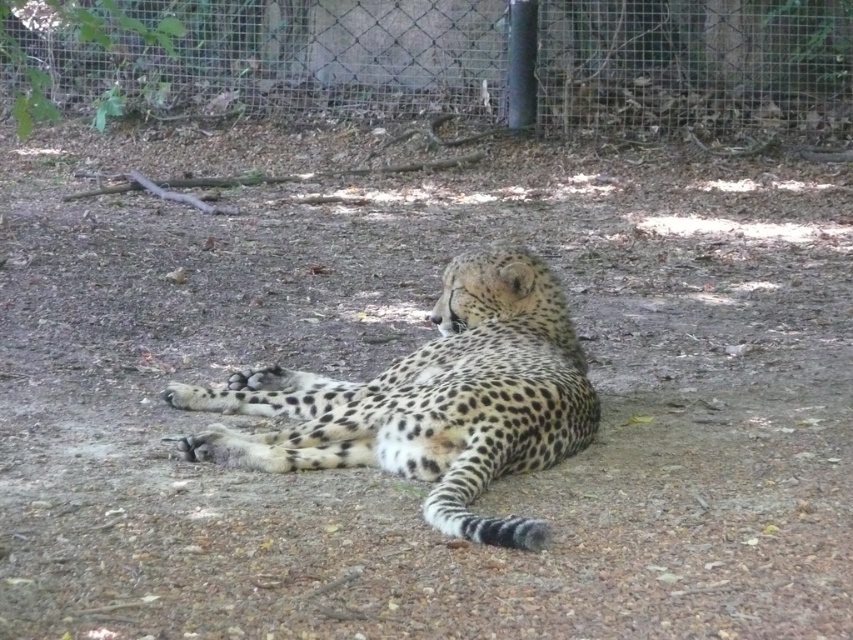
Is point (834, 140) farther from viewer compared to point (595, 413)?

Yes, it is.

Between point (650, 84) and point (372, 456), which one is positioned behind?

Positioned behind is point (650, 84).

Describe the element at coordinates (486, 60) in the screenshot. I see `wire mesh fence at center` at that location.

You are a GUI agent. You are given a task and a screenshot of the screen. Output one action in this format:
    pyautogui.click(x=<x>, y=<y>)
    Task: Click on the wire mesh fence at center
    
    Given the screenshot: What is the action you would take?
    pyautogui.click(x=486, y=60)